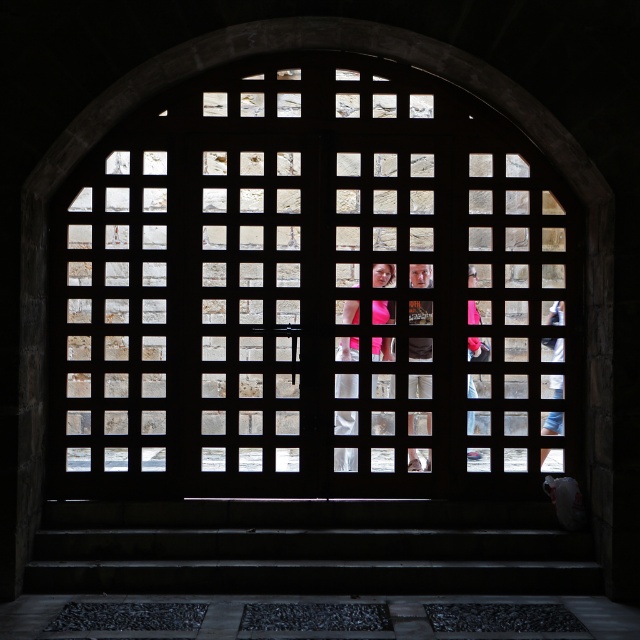
You are standing inside a dimly lit room with an arched window framed by a dark wooden lattice. You notice two points marked in the scene. Can you determine which point, point (x=340, y=449) or point (x=467, y=429), is closer to you based on their positions?

Point (x=467, y=429) is closer to you because point (x=340, y=449) is positioned behind it.

You are standing in a dimly lit room with a large arched window. You notice a wooden lattice at center and a matte pink dress at center. Which object is wider?

The wooden lattice at center is wider than the matte pink dress at center.

You are standing in a dimly lit room with an arched window. You notice the wooden lattice at center and the pink fabric at center. Which object is nearer to you?

The wooden lattice at center is closer to the viewer than the pink fabric at center.